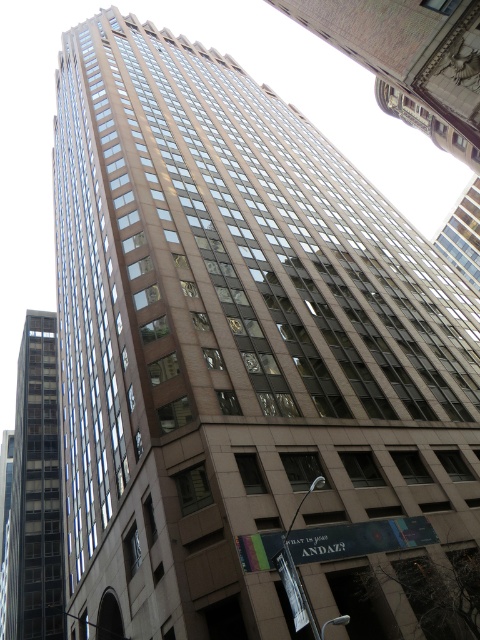
Question: Can you confirm if glassy reflective building at upper center is bigger than dark gray glass building at left?

Choices:
 (A) no
 (B) yes

Answer: (A)

Question: Is glassy reflective building at upper center below dark gray glass building at left?

Choices:
 (A) yes
 (B) no

Answer: (B)

Question: Which of the following is the farthest from the observer?

Choices:
 (A) glassy reflective building at upper center
 (B) dark gray glass building at left

Answer: (B)

Question: Which object is farther from the camera taking this photo?

Choices:
 (A) glassy reflective building at upper center
 (B) dark gray glass building at left

Answer: (B)

Question: Which point is closer to the camera taking this photo?

Choices:
 (A) (29, 602)
 (B) (412, 32)

Answer: (B)

Question: Is glassy reflective building at upper center bigger than dark gray glass building at left?

Choices:
 (A) no
 (B) yes

Answer: (A)